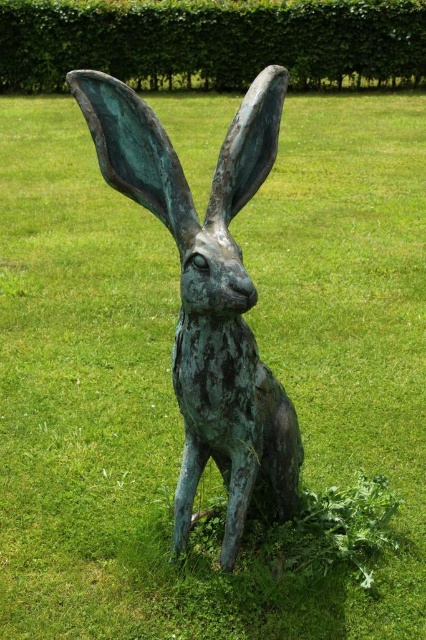
In the scene shown: You are standing in front of the bronze sculpture of a rabbit. There are two points marked on the sculpture, one at coordinate point(x=135, y=109) and another at point(x=143, y=44). Which point is closer to you?

Point(x=135, y=109) is closer to the viewer than point(x=143, y=44).

You are standing in the garden and want to place a new decorative stone at the exact center of the lawn. The green patina bronze hare at center is currently positioned at coordinates 0.461 on the x axis and 0.488 on the y axis. Considering the lawn is perfectly square and the coordinate system starts at the bottom left corner, can you determine whether the hare is positioned to the left or right of the lawn center?

The green patina bronze hare at center is located at coordinates x 0.461 and y 0.488. Since the lawn is square and the coordinate system starts at the bottom left, the exact center would be at x 0.5 and y 0.5. The hare is slightly to the left of the center along the x axis and slightly below on the y axis, but since the question asks specifically about left or right, it is positioned to the left of the lawn center.

You are a gardener who wants to place a new decorative pot between the green patina bronze hare at center and the green leafy hedge at upper center. Considering their heights, which object should the pot be placed closer to in order to ensure visibility?

The green patina bronze hare at center is much taller than the green leafy hedge at upper center, so the pot should be placed closer to the green leafy hedge at upper center to ensure visibility.